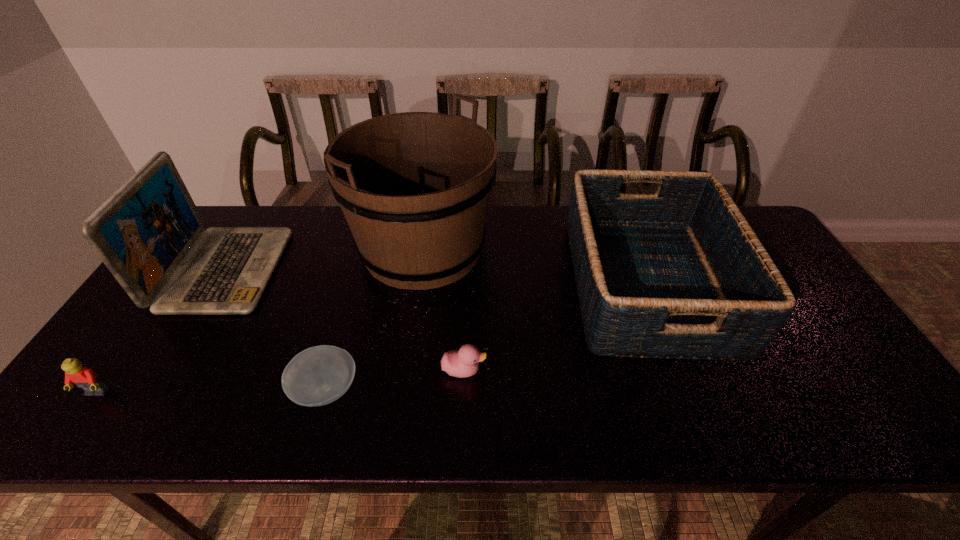
This screenshot has height=540, width=960. I want to click on vacant space situated 0.060m on the face of the Lego, so click(x=73, y=426).

Identify the location of free point located 0.280m on the front-facing side of the duckling. The image size is (960, 540). (604, 370).

At what (x,y) coordinates should I click in order to perform the action: click on vacant area located on the right of the bowl. Please return your answer as a coordinate pair (x, y). Image resolution: width=960 pixels, height=540 pixels. Looking at the image, I should click on point(456,390).

You are a GUI agent. You are given a task and a screenshot of the screen. Output one action in this format:
    pyautogui.click(x=<x>, y=<y>)
    Task: Click on the bucket at the far edge
    Image resolution: width=960 pixels, height=540 pixels.
    Given the screenshot: What is the action you would take?
    pyautogui.click(x=414, y=187)

Locate an element on the screen. laptop computer at the far edge is located at coordinates (150, 226).

The width and height of the screenshot is (960, 540). Find the location of `basket that is positioned at the far edge`. basket that is positioned at the far edge is located at coordinates (x=680, y=274).

Locate an element on the screen. Lego present at the near edge is located at coordinates pyautogui.click(x=85, y=378).

Identify the location of bowl that is at the near edge. The height and width of the screenshot is (540, 960). (319, 375).

Locate an element on the screen. laptop computer that is at the left edge is located at coordinates (150, 226).

Find the location of a particular element. Lego located at the left edge is located at coordinates (85, 378).